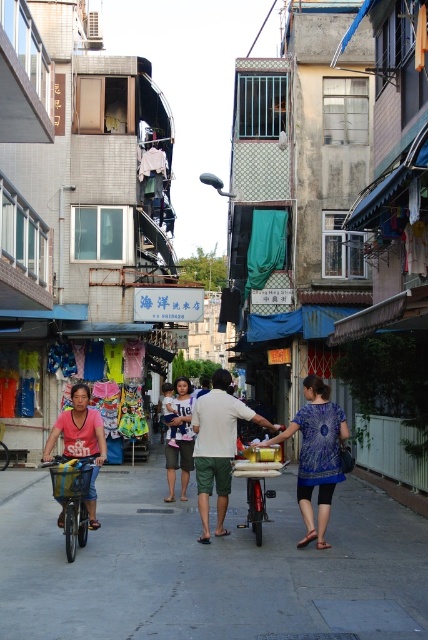
Is gray concrete pavement at center smaller than metallic silver bicycle at center?

No, gray concrete pavement at center is not smaller than metallic silver bicycle at center.

From the picture: Who is more forward, [95,618] or [86,541]?

Positioned in front is point [95,618].

Image resolution: width=428 pixels, height=640 pixels. Describe the element at coordinates (211, 566) in the screenshot. I see `gray concrete pavement at center` at that location.

You are a GUI agent. You are given a task and a screenshot of the screen. Output one action in this format:
    pyautogui.click(x=<x>, y=<y>)
    Task: Click on the gray concrete pavement at center
    This screenshot has width=428, height=640.
    Given the screenshot: What is the action you would take?
    pyautogui.click(x=211, y=566)

Is blue printed blouse at center in front of pink matte shirt at left?

Yes, blue printed blouse at center is closer to the viewer.

Does blue printed blouse at center appear on the left side of pink matte shirt at left?

In fact, blue printed blouse at center is to the right of pink matte shirt at left.

This screenshot has height=640, width=428. Identify the location of blue printed blouse at center. click(315, 454).

Where is `blue printed blouse at center`? blue printed blouse at center is located at coordinates (315, 454).

Is green cotton shorts at center further to the viewer compared to blue denim shorts at center?

No, it is in front of blue denim shorts at center.

Is green cotton shorts at center bigger than blue denim shorts at center?

Incorrect, green cotton shorts at center is not larger than blue denim shorts at center.

Which is in front, point (216, 490) or point (178, 461)?

Positioned in front is point (216, 490).

Where is `green cotton shorts at center`? The image size is (428, 640). green cotton shorts at center is located at coordinates (217, 445).